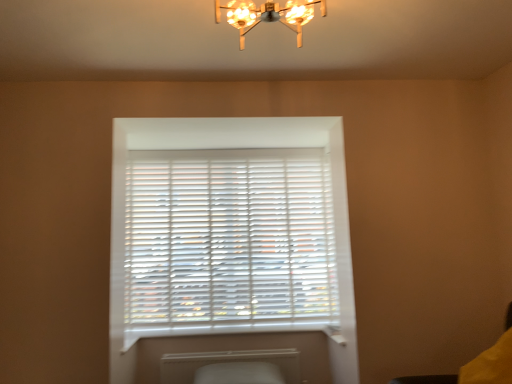
In order to face white matte blinds at center, should I rotate leftwards or rightwards?

To align with it, rotate left about 3.379°.

What do you see at coordinates (233, 331) in the screenshot? This screenshot has height=384, width=512. I see `white plastic window sill at lower center` at bounding box center [233, 331].

This screenshot has width=512, height=384. What do you see at coordinates (426, 379) in the screenshot? I see `yellow fabric swivel chair at lower right` at bounding box center [426, 379].

The height and width of the screenshot is (384, 512). Identify the location of white matte radiator at lower center. (228, 363).

Between white matte blinds at center and white plastic window sill at lower center, which one has larger size?

With larger size is white matte blinds at center.

Is white matte blinds at center not inside white plastic window sill at lower center?

Yes, white matte blinds at center is outside of white plastic window sill at lower center.

Is white matte blinds at center facing away from white plastic window sill at lower center?

white matte blinds at center is not turned away from white plastic window sill at lower center.

Does point (224, 199) come in front of point (286, 361)?

No, it is behind (286, 361).

From the image's perspective, which is above, white matte blinds at center or white matte radiator at lower center?

white matte blinds at center is shown above in the image.

Is white matte blinds at center positioned in front of white matte radiator at lower center?

No, white matte blinds at center is further to the viewer.

Does white matte blinds at center have a lesser height compared to white matte radiator at lower center?

No, white matte blinds at center is not shorter than white matte radiator at lower center.

Is white matte radiator at lower center in front of or behind yellow fabric swivel chair at lower right in the image?

white matte radiator at lower center is behind yellow fabric swivel chair at lower right.

Are white matte radiator at lower center and yellow fabric swivel chair at lower right located far from each other?

white matte radiator at lower center is far away from yellow fabric swivel chair at lower right.

What's the angular difference between white matte radiator at lower center and yellow fabric swivel chair at lower right's facing directions?

The angular difference between white matte radiator at lower center and yellow fabric swivel chair at lower right is 91.1 degrees.

Is point (256, 354) in front of point (408, 383)?

No, it is not.

Is metallic chandelier at upper center positioned beyond the bounds of white plastic window sill at lower center?

That's correct, metallic chandelier at upper center is outside of white plastic window sill at lower center.

From a real-world perspective, which object rests below the other?

From a 3D spatial view, white plastic window sill at lower center is below.

In the scene shown: How different are the orientations of metallic chandelier at upper center and white plastic window sill at lower center in degrees?

The angular difference between metallic chandelier at upper center and white plastic window sill at lower center is 90 degrees.

Visually, is metallic chandelier at upper center positioned to the left or to the right of white plastic window sill at lower center?

metallic chandelier at upper center is positioned on white plastic window sill at lower center's right side.

Considering the relative sizes of yellow fabric swivel chair at lower right and white matte blinds at center in the image provided, is yellow fabric swivel chair at lower right thinner than white matte blinds at center?

In fact, yellow fabric swivel chair at lower right might be wider than white matte blinds at center.

From a real-world perspective, which object rests below the other?

yellow fabric swivel chair at lower right is physically lower.

In the image, is yellow fabric swivel chair at lower right positioned in front of or behind white matte blinds at center?

Clearly, yellow fabric swivel chair at lower right is in front of white matte blinds at center.

In terms of size, does yellow fabric swivel chair at lower right appear bigger or smaller than white matte blinds at center?

yellow fabric swivel chair at lower right is smaller than white matte blinds at center.

This screenshot has width=512, height=384. Find the location of `lamp above the white matte blinds at center (from the image's perspective)`. lamp above the white matte blinds at center (from the image's perspective) is located at coordinates click(269, 15).

Which object is further away from the camera taking this photo, metallic chandelier at upper center or white matte blinds at center?

Positioned behind is white matte blinds at center.

Which of these two, metallic chandelier at upper center or white matte blinds at center, is thinner?

white matte blinds at center is thinner.

Considering the relative positions of metallic chandelier at upper center and white matte blinds at center in the image provided, is metallic chandelier at upper center to the left of white matte blinds at center from the viewer's perspective?

No.

Between white matte blinds at center and yellow fabric swivel chair at lower right, which one is positioned behind?

white matte blinds at center is behind.

Is white matte blinds at center not close to yellow fabric swivel chair at lower right?

Yes, white matte blinds at center and yellow fabric swivel chair at lower right are located far from each other.

Who is bigger, white matte blinds at center or yellow fabric swivel chair at lower right?

white matte blinds at center.

From the picture: Would you say white matte blinds at center contains yellow fabric swivel chair at lower right?

No, white matte blinds at center does not contain yellow fabric swivel chair at lower right.

Locate an element on the screen. The width and height of the screenshot is (512, 384). window sill that is under the white matte blinds at center (from a real-world perspective) is located at coordinates (233, 331).

The image size is (512, 384). In the image, there is a white matte radiator at lower center. What are the coordinates of `window blind above it (from the image's perspective)` in the screenshot? It's located at (228, 240).

Looking at the image, which one is located further to white plastic window sill at lower center, white matte blinds at center or yellow fabric swivel chair at lower right?

yellow fabric swivel chair at lower right.

Looking at the image, which one is located closer to white matte blinds at center, yellow fabric swivel chair at lower right or metallic chandelier at upper center?

Based on the image, yellow fabric swivel chair at lower right appears to be nearer to white matte blinds at center.

From the image, which object appears to be nearer to white plastic window sill at lower center, metallic chandelier at upper center or yellow fabric swivel chair at lower right?

The object closer to white plastic window sill at lower center is yellow fabric swivel chair at lower right.

When comparing their distances from white matte radiator at lower center, does metallic chandelier at upper center or white matte blinds at center seem further?

metallic chandelier at upper center lies further to white matte radiator at lower center than the other object.

Based on their spatial positions, is white matte blinds at center or yellow fabric swivel chair at lower right further from metallic chandelier at upper center?

Based on the image, yellow fabric swivel chair at lower right appears to be further to metallic chandelier at upper center.

Which object lies nearer to the anchor point white plastic window sill at lower center, yellow fabric swivel chair at lower right or white matte radiator at lower center?

The object closer to white plastic window sill at lower center is white matte radiator at lower center.

Estimate the real-world distances between objects in this image. Which object is closer to white matte radiator at lower center, yellow fabric swivel chair at lower right or white matte blinds at center?

white matte blinds at center is positioned closer to the anchor white matte radiator at lower center.

In the scene shown: Which object lies nearer to the anchor point yellow fabric swivel chair at lower right, white plastic window sill at lower center or white matte blinds at center?

white plastic window sill at lower center is positioned closer to the anchor yellow fabric swivel chair at lower right.

Identify the location of window sill located between metallic chandelier at upper center and white matte blinds at center in the depth direction. The height and width of the screenshot is (384, 512). (233, 331).

This screenshot has width=512, height=384. In order to click on window sill positioned between yellow fabric swivel chair at lower right and white matte blinds at center from near to far in this screenshot , I will do `click(233, 331)`.

Where is `swivel chair positioned between metallic chandelier at upper center and white matte radiator at lower center from near to far`? The image size is (512, 384). swivel chair positioned between metallic chandelier at upper center and white matte radiator at lower center from near to far is located at coordinates (426, 379).

Where is `radiator between metallic chandelier at upper center and white matte blinds at center in the front-back direction`? radiator between metallic chandelier at upper center and white matte blinds at center in the front-back direction is located at coordinates (228, 363).